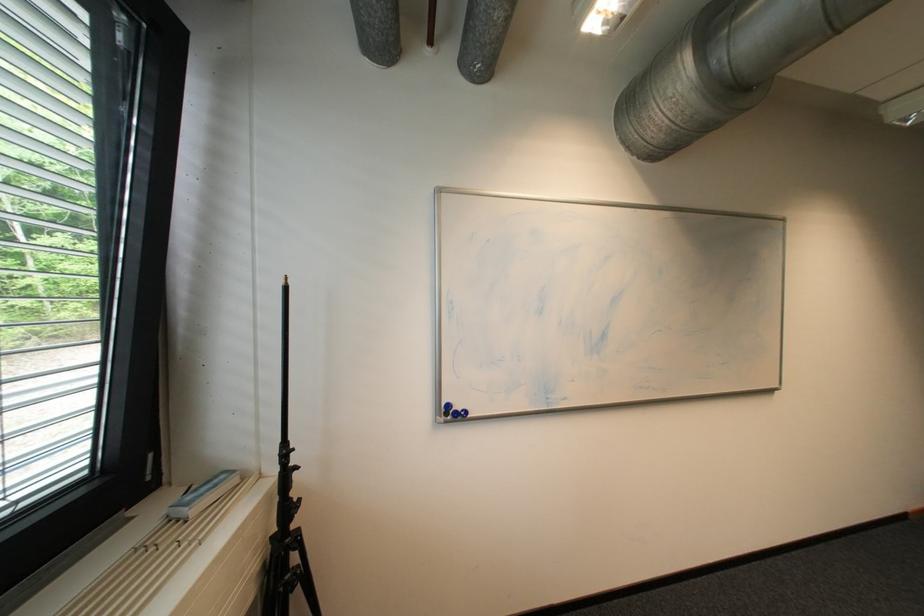
Which object does [203,495] point to?

It corresponds to the level in box in the image.